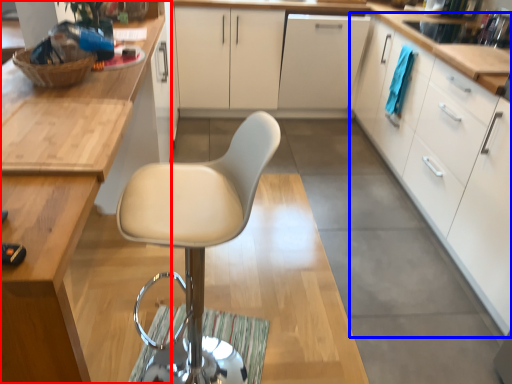
Question: Which point is closer to the camera, cabinetry (highlighted by a red box) or cabinetry (highlighted by a blue box)?

Choices:
 (A) cabinetry
 (B) cabinetry

Answer: (A)